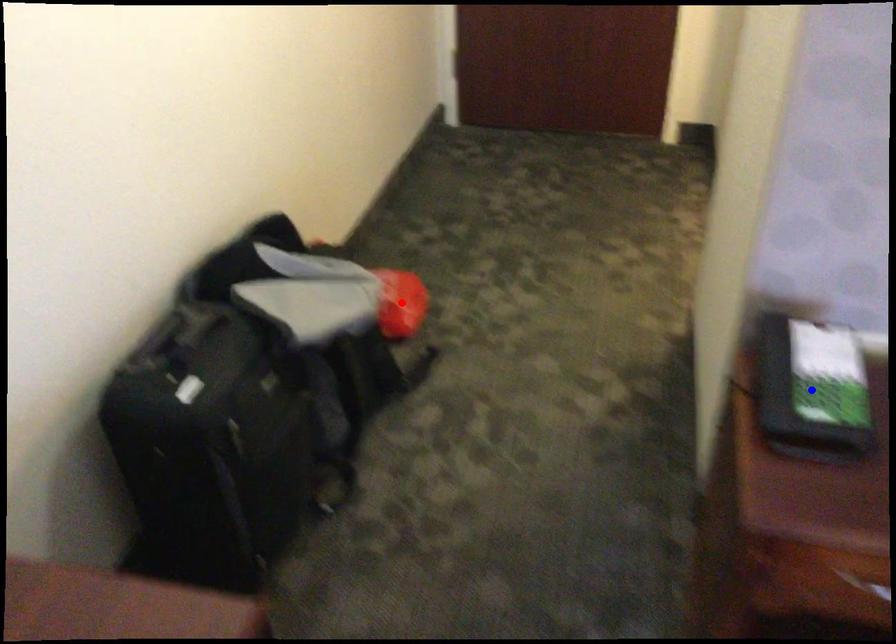
Question: In the image, two points are highlighted. Which point is nearer to the camera? Reply with the corresponding letter.

Choices:
 (A) blue point
 (B) red point

Answer: (A)